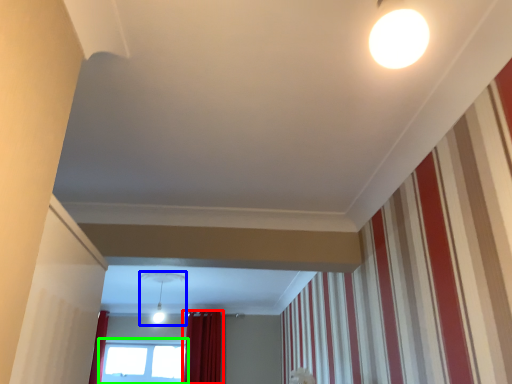
Question: Estimate the real-world distances between objects in this image. Which object is farther from curtain (highlighted by a red box), light fixture (highlighted by a blue box) or window (highlighted by a green box)?

Choices:
 (A) light fixture
 (B) window

Answer: (A)